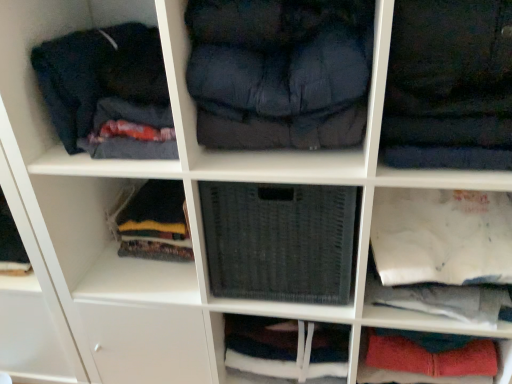
Question: Is the position of dark blue fabric at center, marked as the second clothing in a right-to-left arrangement, more distant than that of dark blue fabric at upper right, placed as the 2th clothing when sorted from left to right?

Choices:
 (A) yes
 (B) no

Answer: (A)

Question: Does dark blue fabric at center, marked as the second clothing in a right-to-left arrangement, have a smaller size compared to dark blue fabric at upper right, the 1th clothing from the right?

Choices:
 (A) yes
 (B) no

Answer: (A)

Question: From a real-world perspective, does dark blue fabric at center, the first clothing in the left-to-right sequence, sit lower than dark blue fabric at upper right, placed as the 2th clothing when sorted from left to right?

Choices:
 (A) no
 (B) yes

Answer: (A)

Question: Is dark blue fabric at center, marked as the second clothing in a right-to-left arrangement, to the right of dark blue fabric at upper right, the 1th clothing from the right, from the viewer's perspective?

Choices:
 (A) yes
 (B) no

Answer: (B)

Question: Does dark blue fabric at center, marked as the second clothing in a right-to-left arrangement, have a greater width compared to dark blue fabric at upper right, placed as the 2th clothing when sorted from left to right?

Choices:
 (A) yes
 (B) no

Answer: (B)

Question: In the image, is woven fabric basket at center, which is the first cabinet from left to right, on the left side or the right side of dark blue fabric at center, marked as the second clothing in a right-to-left arrangement?

Choices:
 (A) right
 (B) left

Answer: (A)

Question: In terms of size, does woven fabric basket at center, which is the first cabinet from left to right, appear bigger or smaller than dark blue fabric at center, the first clothing in the left-to-right sequence?

Choices:
 (A) small
 (B) big

Answer: (B)

Question: From a real-world perspective, is woven fabric basket at center, the 4th cabinet viewed from the right, physically located above or below dark blue fabric at center, marked as the second clothing in a right-to-left arrangement?

Choices:
 (A) above
 (B) below

Answer: (B)

Question: Is point (272, 200) positioned closer to the camera than point (352, 129)?

Choices:
 (A) closer
 (B) farther

Answer: (B)

Question: Relative to woven fabric basket at center, the 4th cabinet viewed from the right, is white paper bag at lower right, placed as the 3th cabinet when sorted from left to right, in front or behind?

Choices:
 (A) front
 (B) behind

Answer: (A)

Question: Visually, is white paper bag at lower right, the 2th cabinet from the right, positioned to the left or to the right of woven fabric basket at center, which is the first cabinet from left to right?

Choices:
 (A) left
 (B) right

Answer: (B)

Question: Does point (437, 264) appear closer or farther from the camera than point (265, 276)?

Choices:
 (A) closer
 (B) farther

Answer: (A)

Question: Do you think white paper bag at lower right, placed as the 3th cabinet when sorted from left to right, is within woven fabric basket at center, the 4th cabinet viewed from the right, or outside of it?

Choices:
 (A) outside
 (B) inside

Answer: (A)

Question: In the image, is dark blue fabric at center, marked as the second clothing in a right-to-left arrangement, on the left side or the right side of dark blue fabric at upper left?

Choices:
 (A) left
 (B) right

Answer: (B)

Question: From a real-world perspective, is dark blue fabric at center, the first clothing in the left-to-right sequence, above or below dark blue fabric at upper left?

Choices:
 (A) below
 (B) above

Answer: (B)